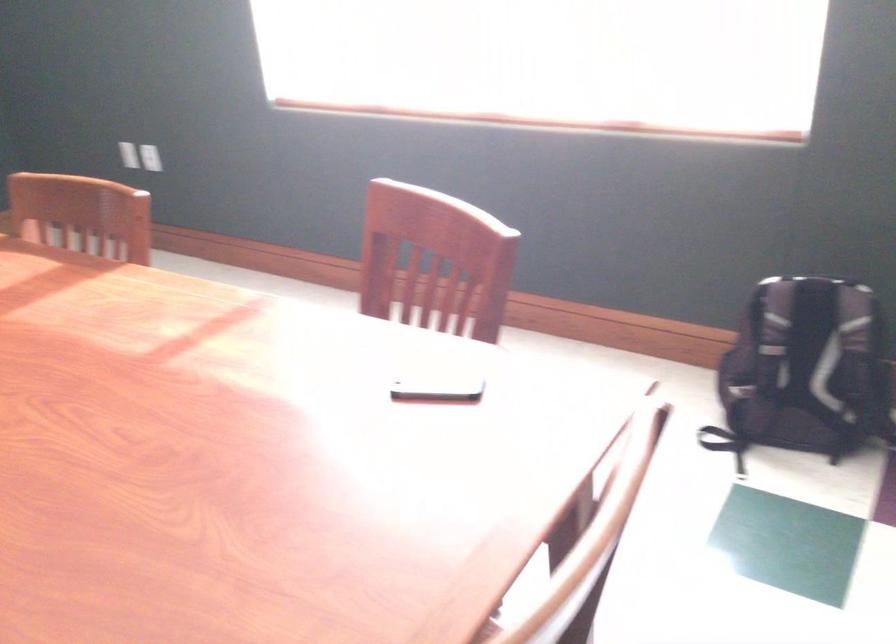
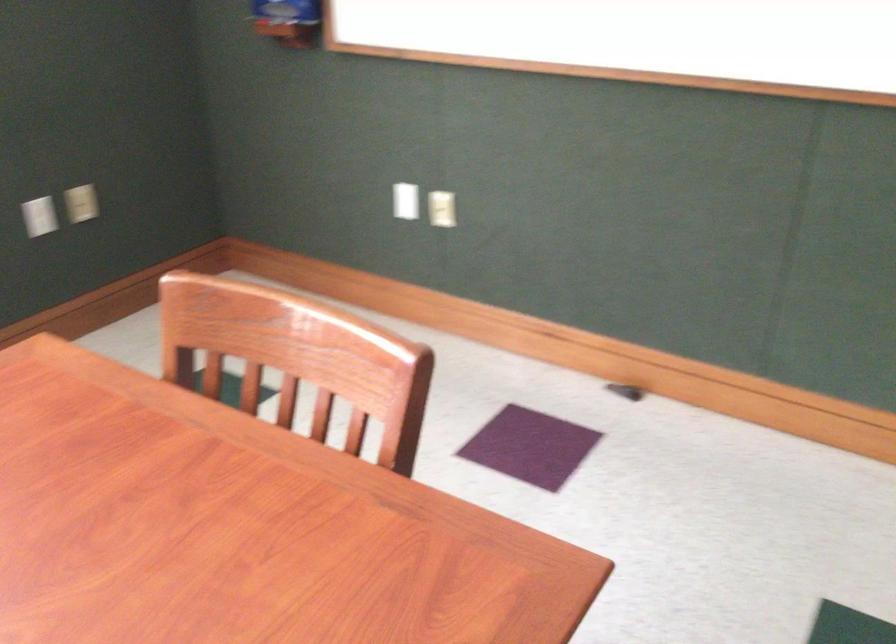
The images are taken continuously from a first-person perspective. In which direction is your viewpoint rotating?

The rotation direction of the camera is right-down.